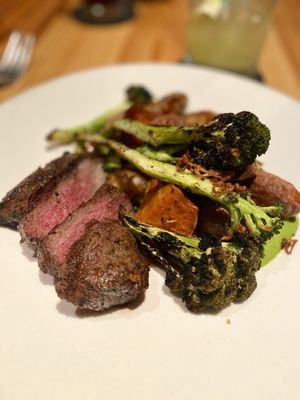
Locate an element on the screen. The image size is (300, 400). plate is located at coordinates (21, 136).